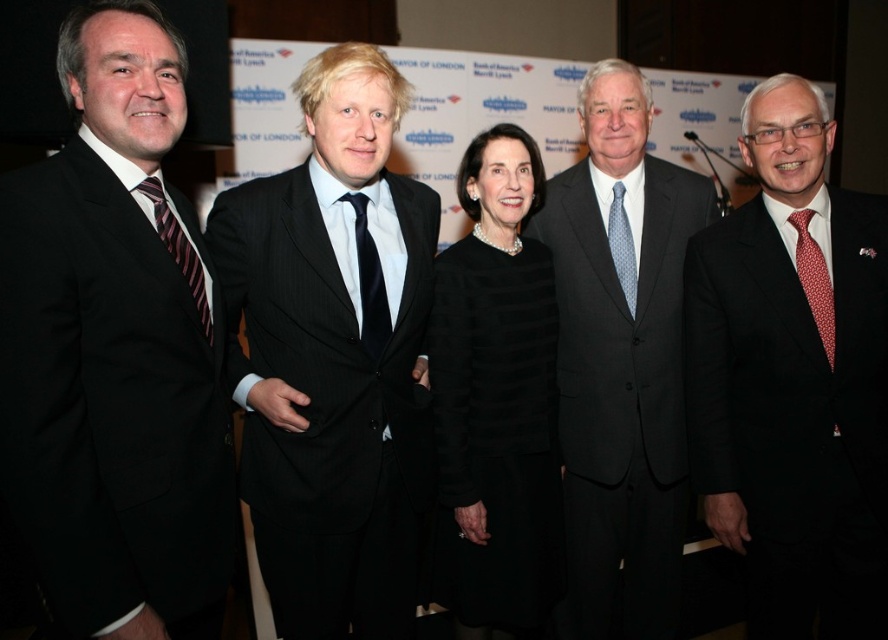
You are a photographer at the event. You need to adjust the lighting so that both the matte black suit at right and the striped silk tie at left are clearly visible. Which object should you focus on first to ensure proper exposure?

You should focus on the matte black suit at right first because it is in front of the striped silk tie at left, so adjusting the exposure for the matte black suit at right will ensure the striped silk tie at left is also properly lit.

You are standing at point point [386,193] and want to take a photo of the group of five individuals. The camera you have requires you to be at least 2 meters away to avoid blurring the image. Can you take a clear photo from your current position?

The distance between point [386,193] and the camera is 1.72 meters. Since this is less than the required 2 meters, the photo may be blurry and not clear.